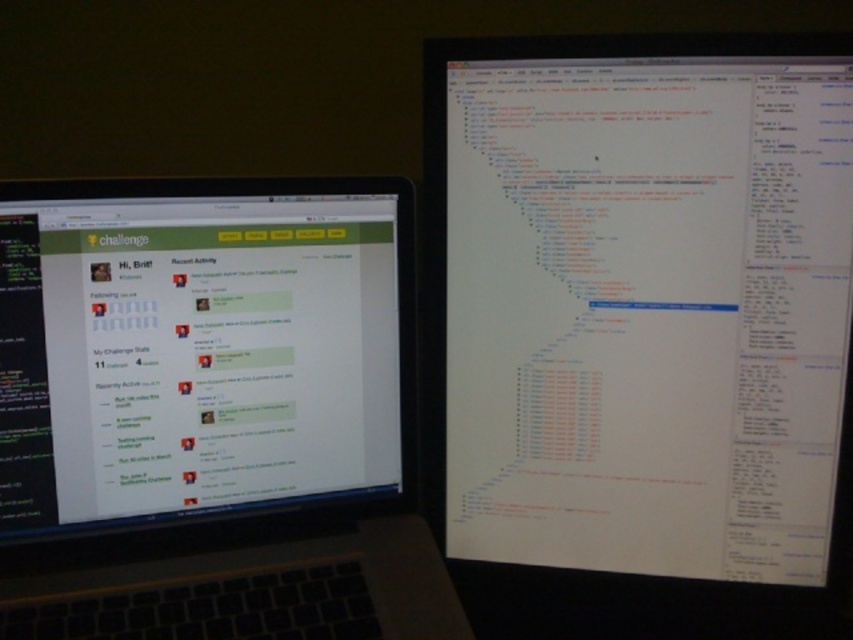
Looking at this image, is white paper at center to the left of black matte keyboard at lower left from the viewer's perspective?

Incorrect, white paper at center is not on the left side of black matte keyboard at lower left.

In the scene shown: Does white paper at center appear under black matte keyboard at lower left?

No, white paper at center is not below black matte keyboard at lower left.

The height and width of the screenshot is (640, 853). What are the coordinates of `white paper at center` in the screenshot? It's located at (642, 301).

Who is more distant from viewer, [590,76] or [102,550]?

Positioned behind is point [102,550].

Between point (547, 228) and point (408, 376), which one is positioned in front?

Point (547, 228) is more forward.

Which is in front, point (608, 385) or point (277, 202)?

Positioned in front is point (277, 202).

The image size is (853, 640). In order to click on white paper at center in this screenshot , I will do `click(642, 301)`.

Is the position of silver metallic laptop at left less distant than that of black matte keyboard at lower left?

No.

Describe the element at coordinates (212, 413) in the screenshot. I see `silver metallic laptop at left` at that location.

Does point (347, 380) come in front of point (206, 552)?

That is False.

Find the location of `silver metallic laptop at left`. silver metallic laptop at left is located at coordinates (212, 413).